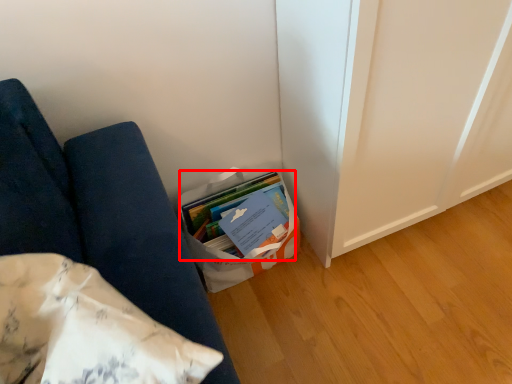
Question: Observing the image, what is the correct spatial positioning of book (annotated by the red box) in reference to furniture?

Choices:
 (A) left
 (B) right

Answer: (B)